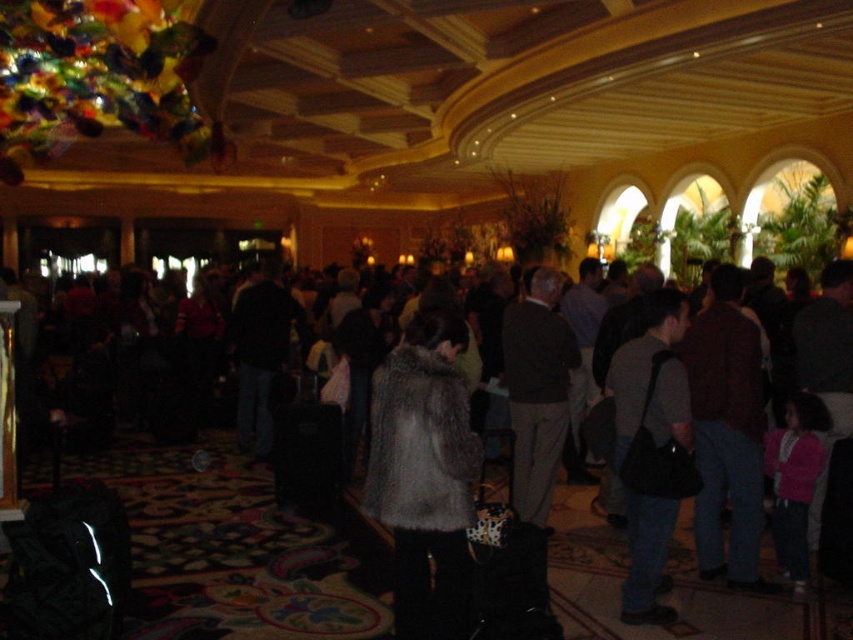
Is point (376, 368) positioned behind point (514, 387)?

Yes, it is.

What do you see at coordinates (424, 476) in the screenshot? This screenshot has width=853, height=640. I see `fuzzy gray coat at center` at bounding box center [424, 476].

Where is `fuzzy gray coat at center`? The width and height of the screenshot is (853, 640). fuzzy gray coat at center is located at coordinates (424, 476).

Is point (664, 300) positioned after point (549, 492)?

No, it is not.

Is the position of gray fuzzy coat at center more distant than that of dark gray suit at center?

No, it is in front of dark gray suit at center.

Locate an element on the screen. gray fuzzy coat at center is located at coordinates (648, 445).

Can you confirm if fuzzy gray coat at center is positioned above gray fuzzy coat at center?

Incorrect, fuzzy gray coat at center is not positioned above gray fuzzy coat at center.

Which is in front, point (407, 452) or point (672, 396)?

Point (407, 452) is in front.

Which is in front, point (439, 637) or point (657, 577)?

Point (439, 637) is in front.

Locate an element on the screen. This screenshot has height=640, width=853. fuzzy gray coat at center is located at coordinates (424, 476).